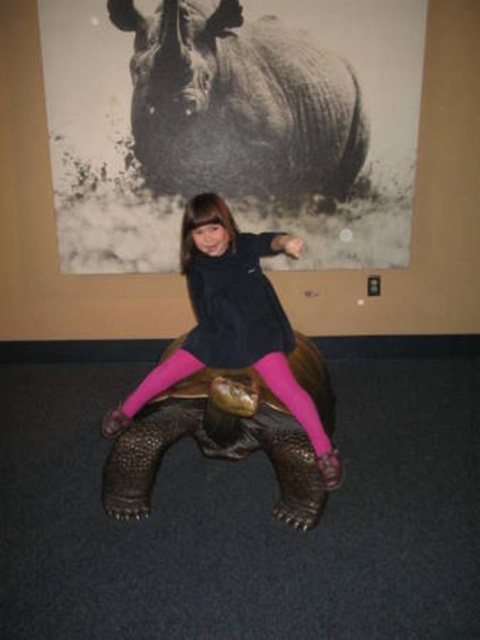
Question: Which object appears closest to the camera in this image?

Choices:
 (A) black textured rhinoceros at upper center
 (B) pink matte/tacky tights at center
 (C) leather-like tortoise at center

Answer: (C)

Question: Which point is farther to the camera?

Choices:
 (A) pink matte/tacky tights at center
 (B) black textured rhinoceros at upper center

Answer: (B)

Question: Which point is farther to the camera?

Choices:
 (A) pink matte/tacky tights at center
 (B) black textured rhinoceros at upper center
 (C) leather-like tortoise at center

Answer: (B)

Question: Is black textured rhinoceros at upper center further to the viewer compared to leather-like tortoise at center?

Choices:
 (A) yes
 (B) no

Answer: (A)

Question: Is black textured rhinoceros at upper center further to camera compared to leather-like tortoise at center?

Choices:
 (A) no
 (B) yes

Answer: (B)

Question: Can you confirm if leather-like tortoise at center is positioned above pink matte/tacky tights at center?

Choices:
 (A) yes
 (B) no

Answer: (B)